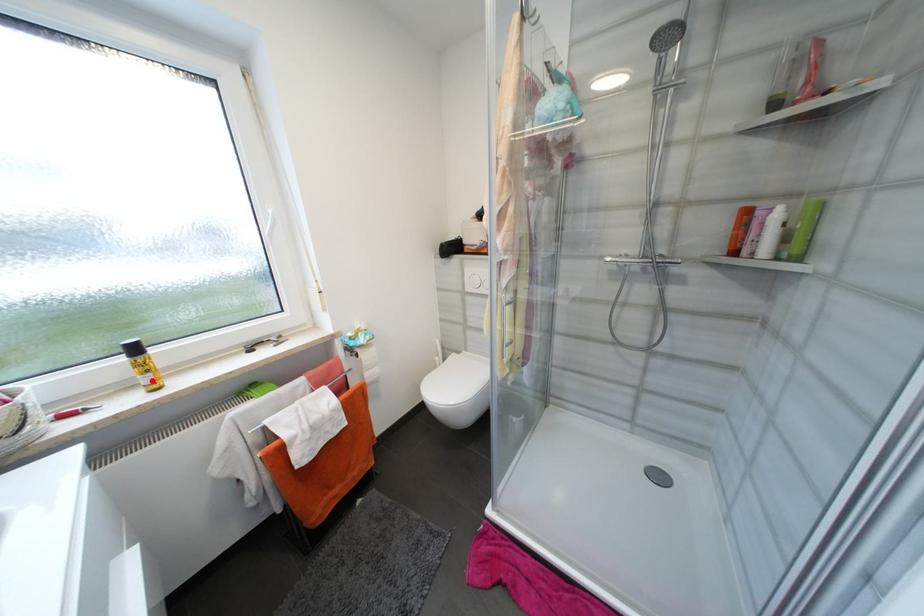
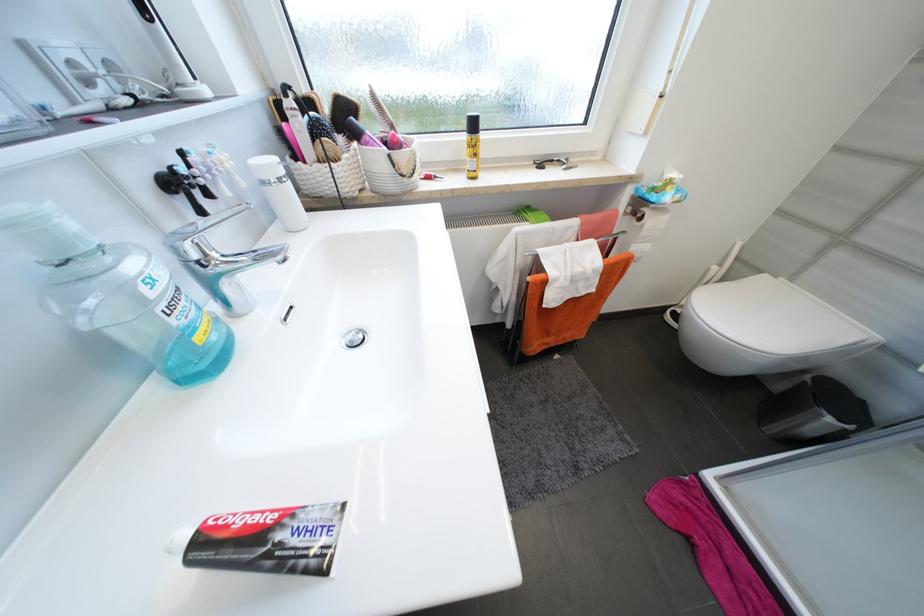
Question: I am providing you with two images of the same scene from different viewpoints. A red point is marked on the first image. At the location where the point appears in image 1, is it still visible in image 2?

Choices:
 (A) Yes
 (B) No

Answer: (A)